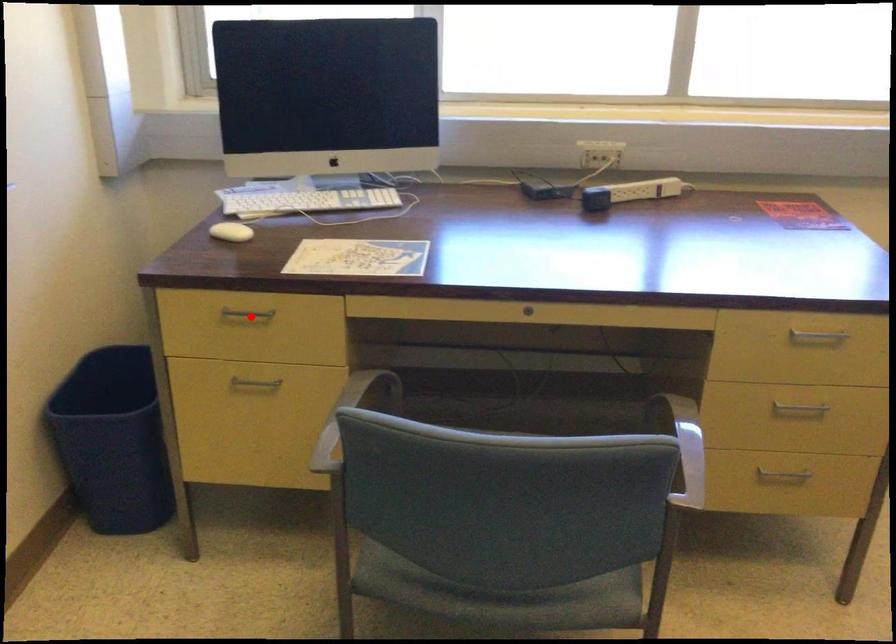
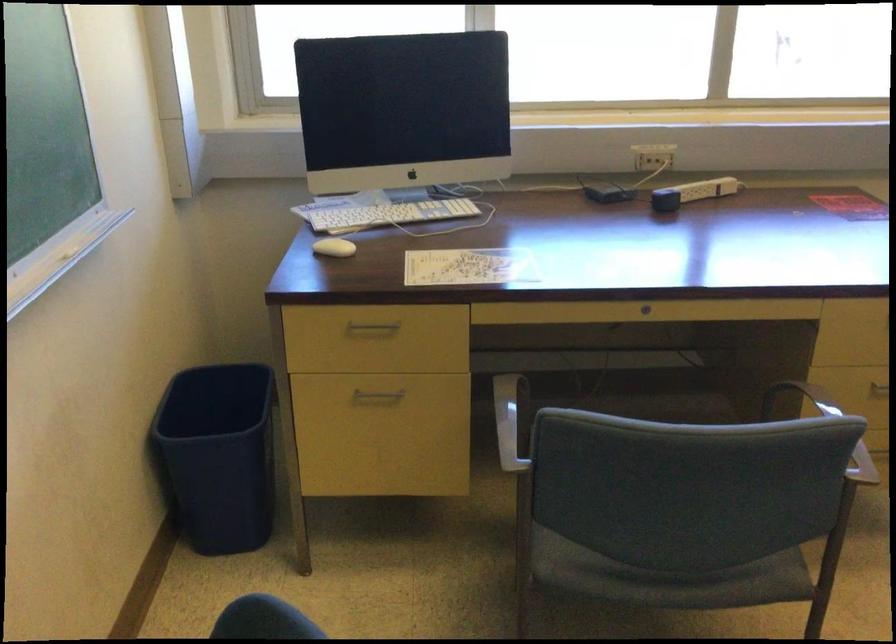
Find the pixel in the second image that matches the highlighted location in the first image.

(373, 327)